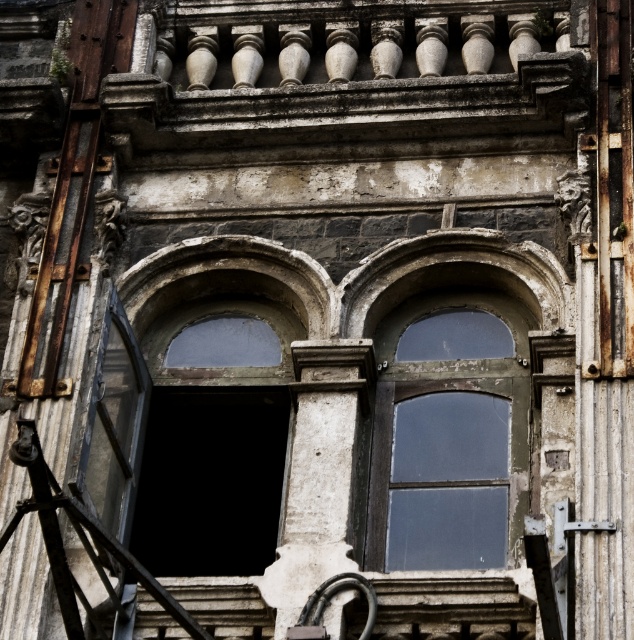
You are an architect examining the building from the ground. You notice the white stone balustrade at upper center and the transparent glass window at center. Which object appears closer to you in the image?

The white stone balustrade at upper center appears closer to you because it is positioned further to the viewer than the transparent glass window at center.

You are a window cleaner standing on the ground in front of the old building. You need to clean the transparent glass window at center and the white stone balustrade at upper center. Which object will require you to climb higher to reach?

The white stone balustrade at upper center is above the transparent glass window at center, so you will need to climb higher to reach it.